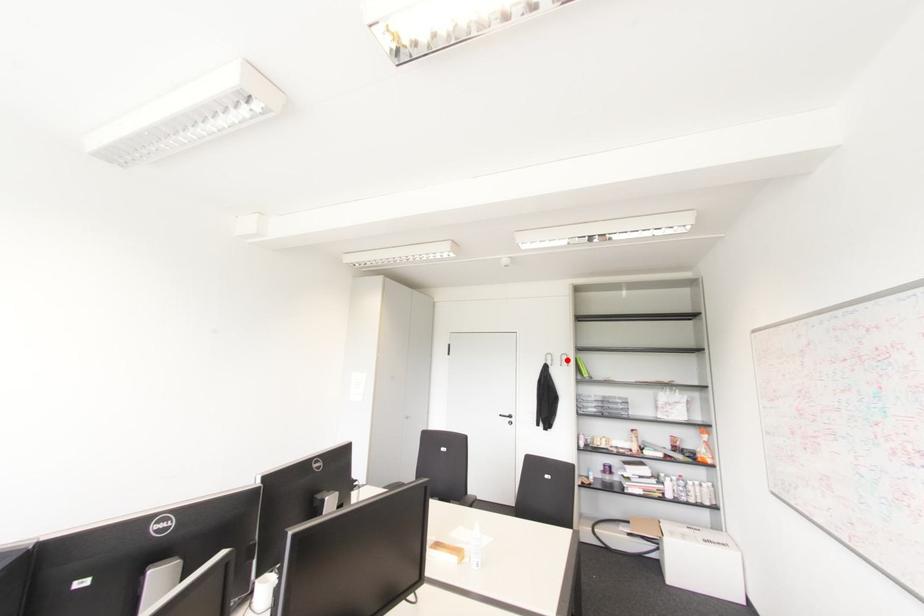
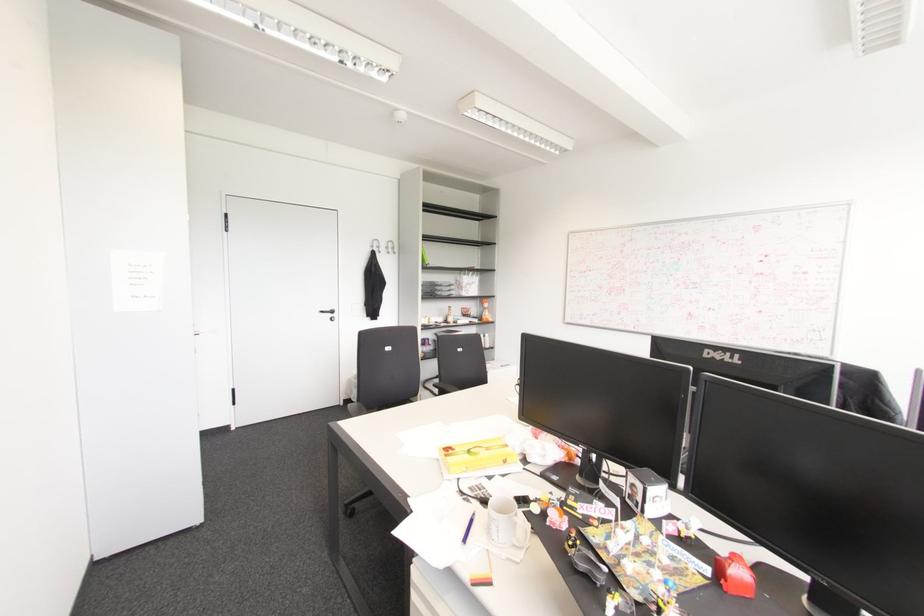
In the second image, find the point that corresponds to the highlighted location in the first image.

(392, 248)